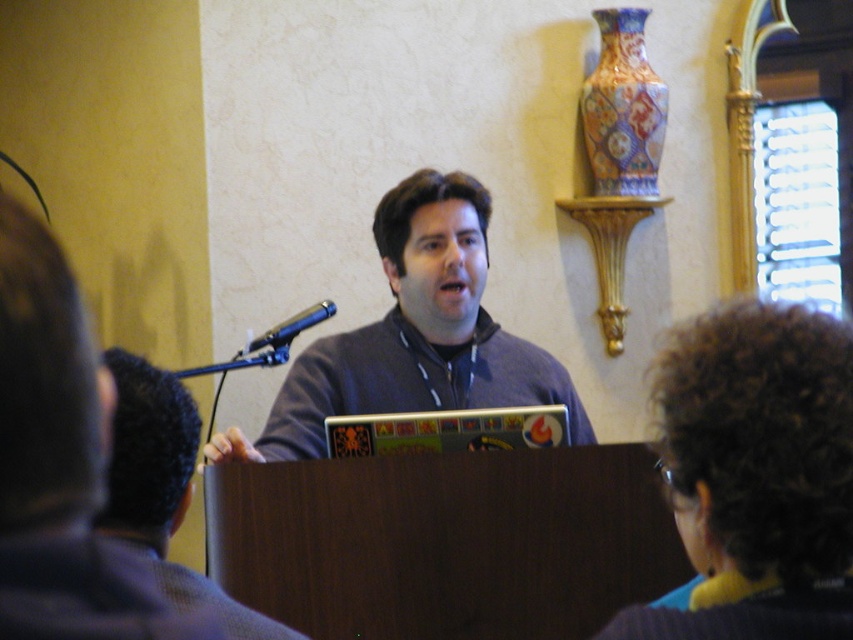
Question: Which object is closer to the camera taking this photo?

Choices:
 (A) dark gray hoodie at center
 (B) metallic blue microphone at center
 (C) gray fabric shirt at center
 (D) gray matte laptop at center

Answer: (A)

Question: Which point appears farthest from the camera in this image?

Choices:
 (A) (325, 412)
 (B) (306, 312)
 (C) (115, 476)
 (D) (749, 420)

Answer: (B)

Question: Is curly hair at upper right bigger than dark gray hoodie at center?

Choices:
 (A) yes
 (B) no

Answer: (A)

Question: Among these points, which one is farthest from the camera?

Choices:
 (A) (314, 310)
 (B) (83, 317)

Answer: (A)

Question: Is curly hair at upper right to the right of metallic blue microphone at center from the viewer's perspective?

Choices:
 (A) yes
 (B) no

Answer: (A)

Question: Is dark gray hoodie at center to the right of gray matte laptop at center from the viewer's perspective?

Choices:
 (A) no
 (B) yes

Answer: (A)